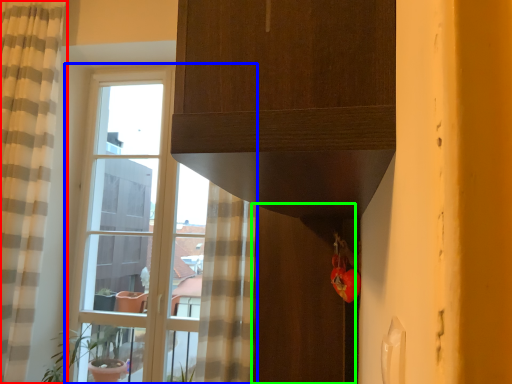
Question: Which object is the farthest from curtain (highlighted by a red box)? Choose among these: window (highlighted by a blue box) or screen door (highlighted by a green box).

Choices:
 (A) window
 (B) screen door

Answer: (B)